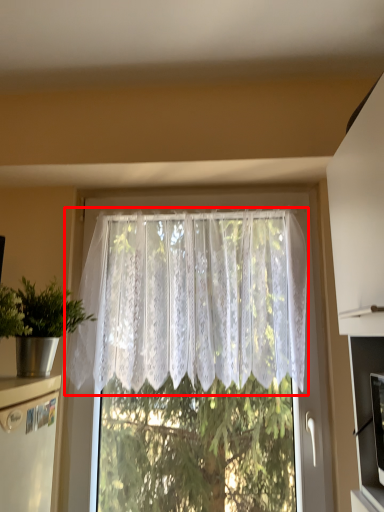
Question: In this image, where is curtain (annotated by the red box) located relative to houseplant?

Choices:
 (A) right
 (B) left

Answer: (A)